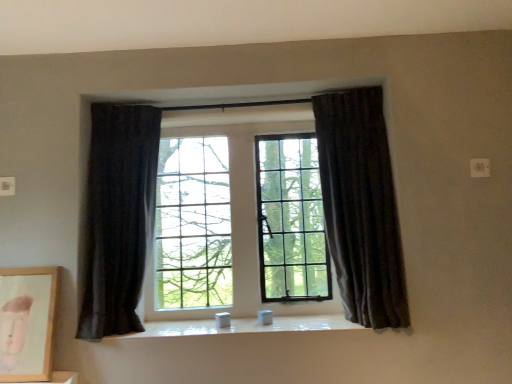
Identify the location of free space above dark fabric curtain at left, arranged as the second curtain when viewed from the right (from a real-world perspective). (124, 93).